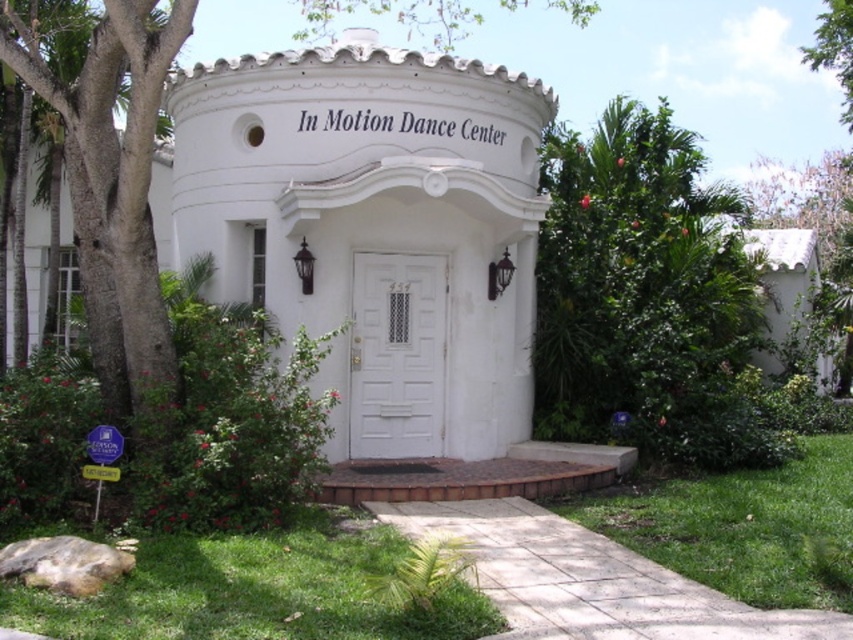
Consider the image. Does white matte door at center have a greater height compared to green leafy tree at center?

Correct, white matte door at center is much taller as green leafy tree at center.

I want to click on white matte door at center, so click(375, 227).

Who is more forward, (x=287, y=109) or (x=717, y=372)?

Positioned in front is point (x=287, y=109).

Locate an element on the screen. The width and height of the screenshot is (853, 640). white matte door at center is located at coordinates (375, 227).

You are a GUI agent. You are given a task and a screenshot of the screen. Output one action in this format:
    pyautogui.click(x=<x>, y=<y>)
    Task: Click on the white matte door at center
    
    Given the screenshot: What is the action you would take?
    pyautogui.click(x=375, y=227)

How far apart are white matte door at center and white wooden door at center?

white matte door at center and white wooden door at center are 28.86 inches apart from each other.

Which is behind, point (209, 232) or point (370, 442)?

The point (209, 232) is more distant.

You are a GUI agent. You are given a task and a screenshot of the screen. Output one action in this format:
    pyautogui.click(x=<x>, y=<y>)
    Task: Click on the white matte door at center
    Image resolution: width=853 pixels, height=640 pixels.
    Given the screenshot: What is the action you would take?
    pyautogui.click(x=375, y=227)

Based on the photo, is green leafy tree at center to the left of white wooden door at center from the viewer's perspective?

In fact, green leafy tree at center is to the right of white wooden door at center.

How distant is green leafy tree at center from white wooden door at center?

green leafy tree at center is 6.74 feet away from white wooden door at center.

Who is more distant from viewer, (x=604, y=234) or (x=421, y=328)?

Positioned behind is point (x=604, y=234).

Where is `green leafy tree at center`? green leafy tree at center is located at coordinates (643, 296).